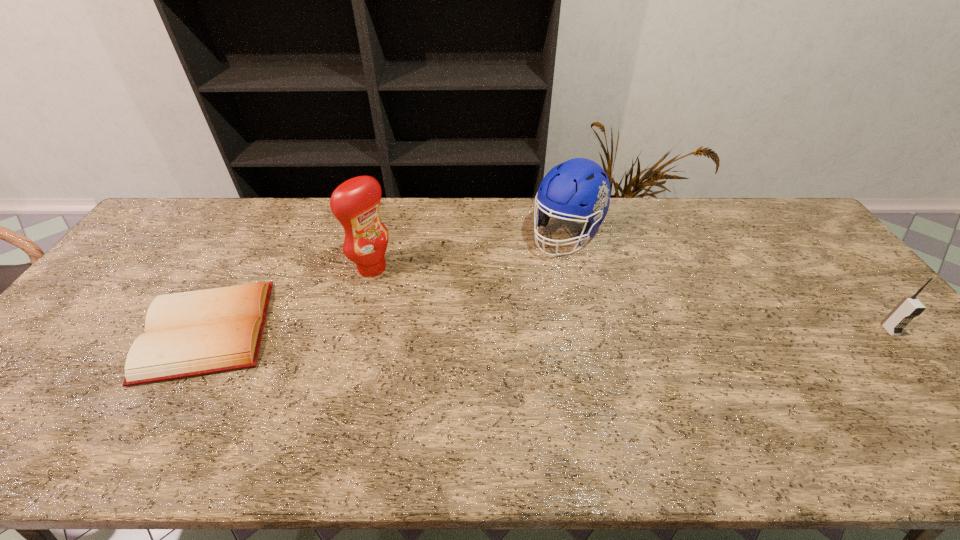
Where is `vacant space in between the second object from right to left and the condiment`? The width and height of the screenshot is (960, 540). vacant space in between the second object from right to left and the condiment is located at coordinates (469, 251).

The height and width of the screenshot is (540, 960). I want to click on blank region between the condiment and the third tallest object, so click(631, 299).

The height and width of the screenshot is (540, 960). In order to click on vacant space in between the second object from left to right and the Bible in this screenshot , I will do `click(290, 299)`.

This screenshot has width=960, height=540. In order to click on free space that is in between the third tallest object and the football helmet in this screenshot , I will do `click(728, 282)`.

Where is `vacant point located between the football helmet and the cellular telephone`? The width and height of the screenshot is (960, 540). vacant point located between the football helmet and the cellular telephone is located at coordinates (728, 282).

Locate which object is the second closest to the leftmost object. Please provide its 2D coordinates. Your answer should be formatted as a tuple, i.e. [(x, y)], where the tuple contains the x and y coordinates of a point satisfying the conditions above.

[(579, 188)]

Identify the location of object that is the closest to the second object from right to left. This screenshot has width=960, height=540. (355, 203).

Where is `vacant position in the image that satisfies the following two spatial constraints: 1. on the back side of the third object from right to left; 2. on the left side of the third shortest object`? This screenshot has height=540, width=960. vacant position in the image that satisfies the following two spatial constraints: 1. on the back side of the third object from right to left; 2. on the left side of the third shortest object is located at coordinates (381, 234).

You are a GUI agent. You are given a task and a screenshot of the screen. Output one action in this format:
    pyautogui.click(x=<x>, y=<y>)
    Task: Click on the free spot that satisfies the following two spatial constraints: 1. on the back side of the second object from left to right; 2. on the right side of the second object from right to left
    The width and height of the screenshot is (960, 540).
    Given the screenshot: What is the action you would take?
    pyautogui.click(x=381, y=234)

At what (x,y) coordinates should I click in order to perform the action: click on vacant space that satisfies the following two spatial constraints: 1. on the back side of the condiment; 2. on the right side of the leftmost object. Please return your answer as a coordinate pair (x, y). This screenshot has width=960, height=540. Looking at the image, I should click on (243, 268).